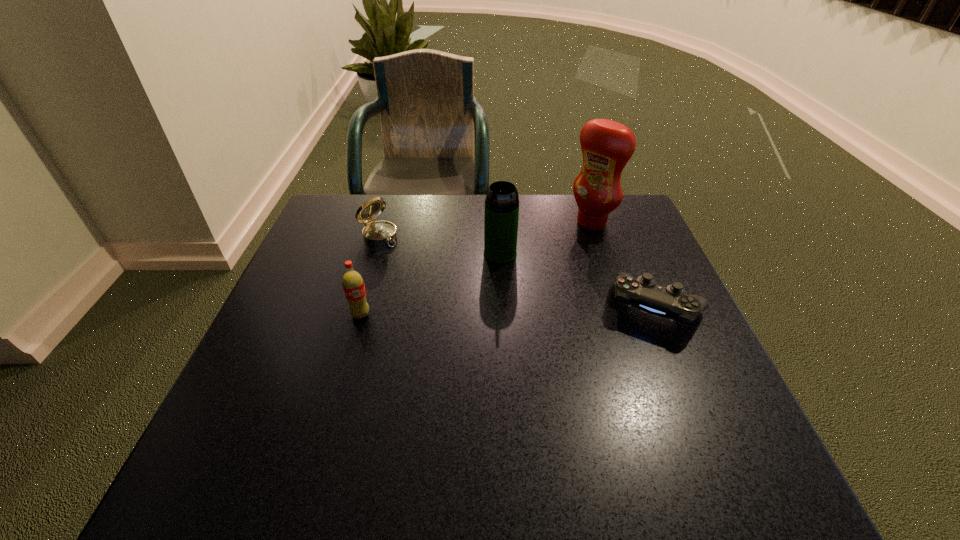
Locate an element on the screen. The height and width of the screenshot is (540, 960). free spot on the desktop that is between the third tallest object and the control and is positioned with the dial facing the second shortest object is located at coordinates (480, 312).

Locate an element on the screen. This screenshot has width=960, height=540. vacant space on the desktop that is between the soda and the control and is positioned on the label side of the tallest object is located at coordinates (474, 312).

The width and height of the screenshot is (960, 540). In order to click on free spot on the desktop that is between the soda and the shortest object and is positioned from the spout of the fourth shortest object in this screenshot , I will do `click(508, 312)`.